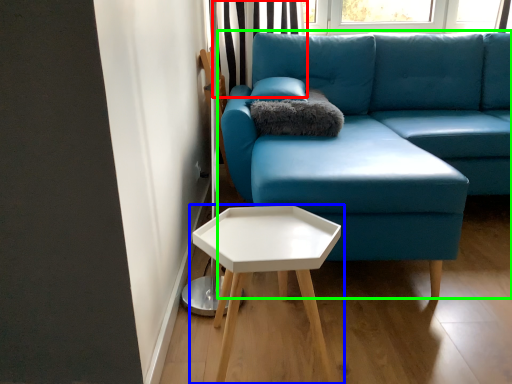
Question: Which is nearer to the curtain (highlighted by a red box)? table (highlighted by a blue box) or studio couch (highlighted by a green box).

Choices:
 (A) table
 (B) studio couch

Answer: (B)